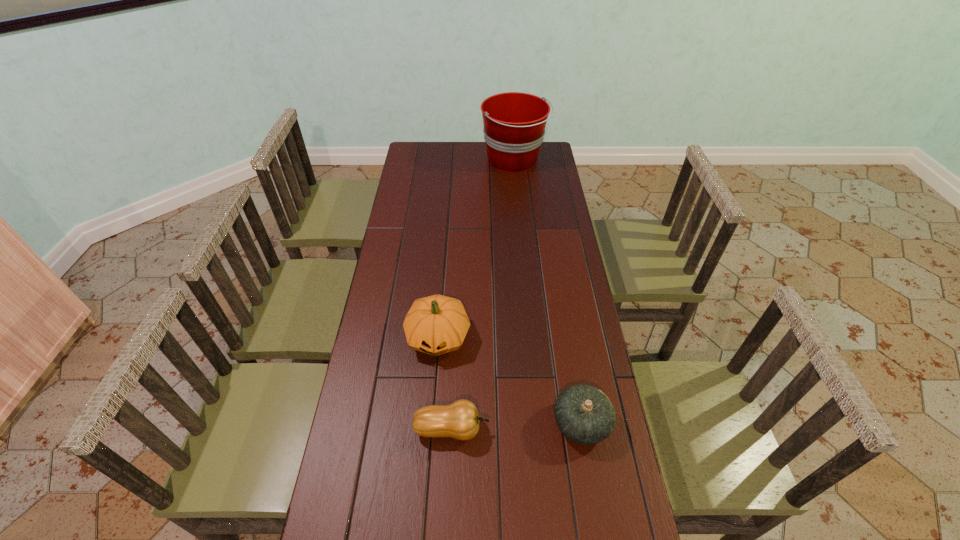
The width and height of the screenshot is (960, 540). In order to click on the tallest object in this screenshot , I will do `click(514, 123)`.

This screenshot has width=960, height=540. I want to click on the farthest object, so click(514, 123).

This screenshot has width=960, height=540. Identify the location of the tallest gourd. (437, 324).

At what (x,y) coordinates should I click in order to perform the action: click on the third shortest object. Please return your answer as a coordinate pair (x, y). Looking at the image, I should click on (437, 324).

Where is `the rightmost gourd`? This screenshot has height=540, width=960. the rightmost gourd is located at coordinates (584, 414).

Find the location of a particular element. the second tallest gourd is located at coordinates (584, 414).

Where is `the shortest object`? This screenshot has width=960, height=540. the shortest object is located at coordinates (460, 420).

Locate an element on the screen. Image resolution: width=960 pixels, height=540 pixels. vacant space situated 0.070m on the left of the bucket is located at coordinates (467, 160).

At what (x,y) coordinates should I click in order to perform the action: click on free location located on the side of the tallest gourd with the carved face. Please return your answer as a coordinate pair (x, y). Image resolution: width=960 pixels, height=540 pixels. Looking at the image, I should click on (426, 478).

You are a GUI agent. You are given a task and a screenshot of the screen. Output one action in this format:
    pyautogui.click(x=<x>, y=<y>)
    Task: Click on the vacant space located 0.320m on the back of the rightmost gourd
    
    Given the screenshot: What is the action you would take?
    pyautogui.click(x=563, y=312)